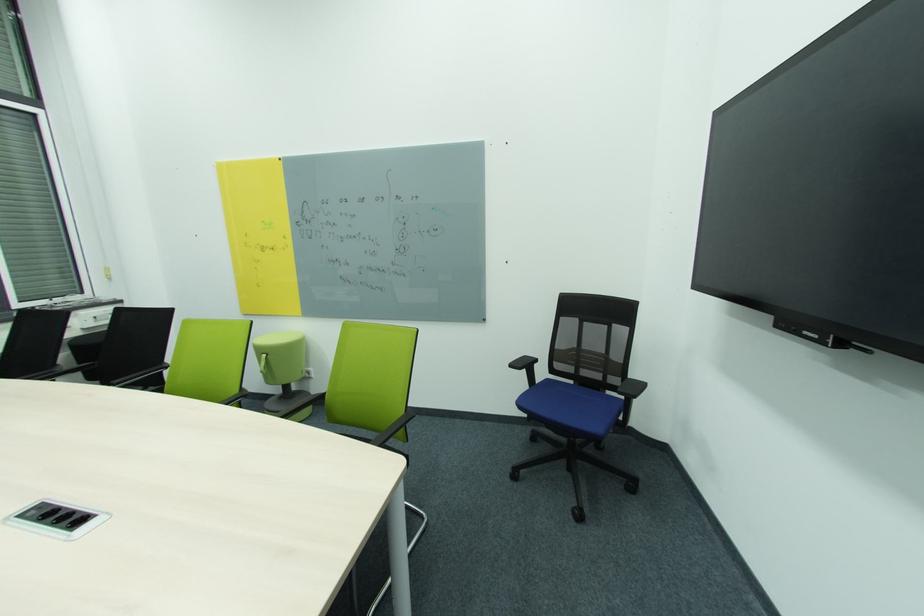
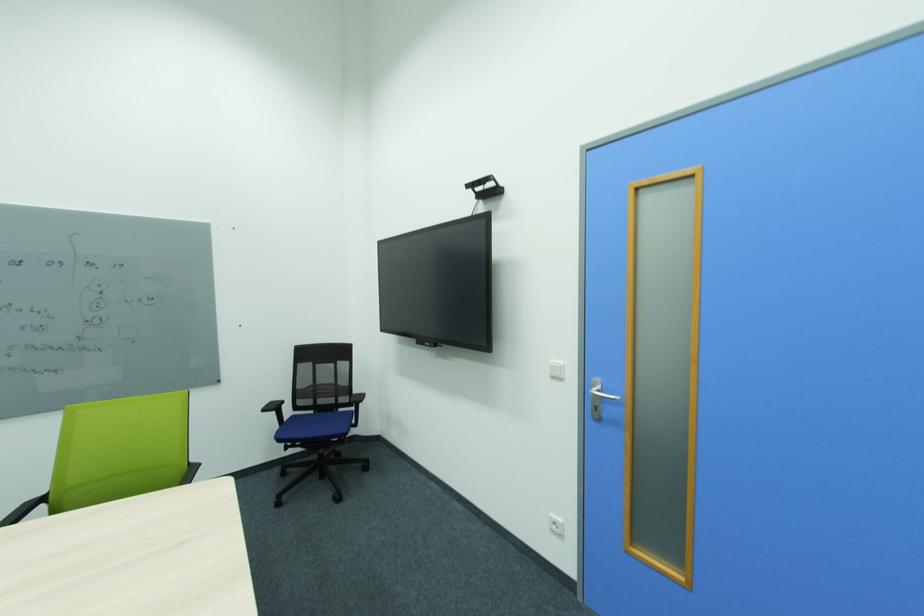
In the second image, find the point that corresponds to (x=517, y=367) in the first image.

(270, 411)